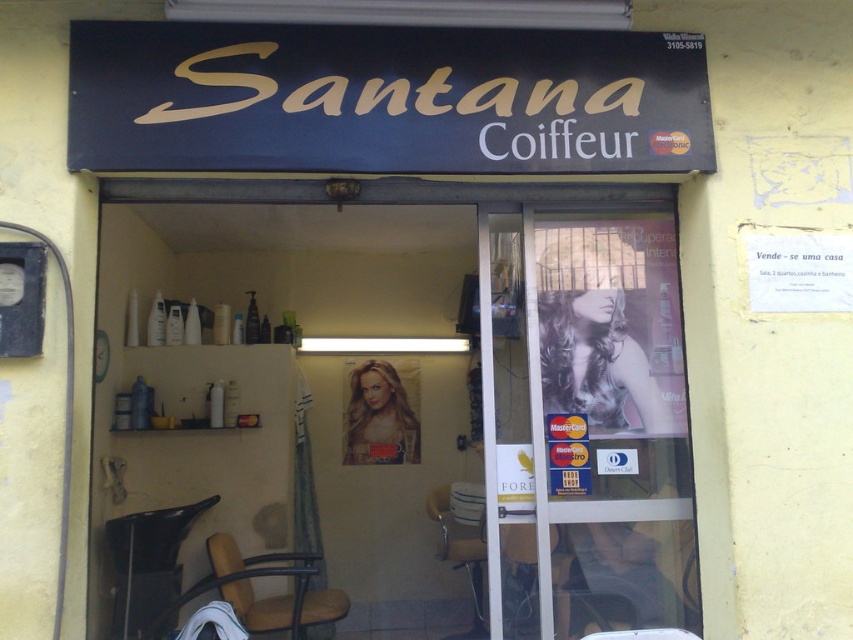
Question: Which is nearer to the brown leather chair at lower center?

Choices:
 (A) metallic gold chair at center
 (B) matte gold sign at upper center
 (C) black plastic chair at lower left
 (D) transparent glass door at center

Answer: (C)

Question: Can you confirm if matte gold sign at upper center is positioned below black plastic chair at lower left?

Choices:
 (A) yes
 (B) no

Answer: (B)

Question: Which of the following is the closest to the observer?

Choices:
 (A) (585, 488)
 (B) (474, 536)
 (C) (395, 116)
 (D) (138, 541)

Answer: (C)

Question: Which of these objects is positioned closest to the transparent glass door at center?

Choices:
 (A) brown leather chair at lower center
 (B) metallic gold chair at center
 (C) matte gold sign at upper center

Answer: (C)

Question: Is black plastic chair at lower left thinner than metallic gold chair at center?

Choices:
 (A) yes
 (B) no

Answer: (B)

Question: Is matte gold sign at upper center to the left of transparent glass door at center from the viewer's perspective?

Choices:
 (A) yes
 (B) no

Answer: (A)